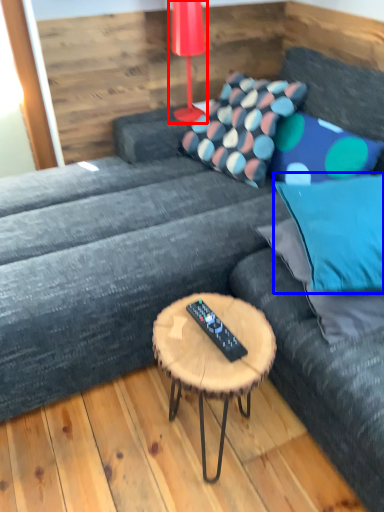
Question: Which object appears farthest to the camera in this image, table lamp (highlighted by a red box) or pillow (highlighted by a blue box)?

Choices:
 (A) table lamp
 (B) pillow

Answer: (A)